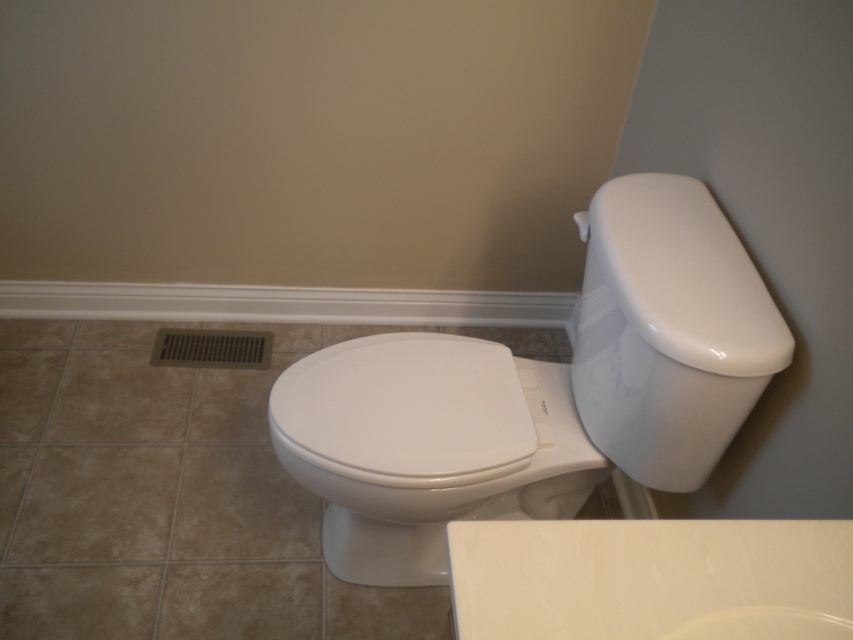
Does white glossy toilet at center have a larger size compared to white glossy toilet lid at upper right?

Correct, white glossy toilet at center is larger in size than white glossy toilet lid at upper right.

Based on the photo, which is more to the left, white glossy toilet at center or white glossy toilet lid at upper right?

white glossy toilet at center

At what (x,y) coordinates should I click in order to perform the action: click on white glossy toilet at center. Please return your answer as a coordinate pair (x, y). Looking at the image, I should click on (538, 392).

Where is `white glossy toilet at center`? This screenshot has height=640, width=853. white glossy toilet at center is located at coordinates (538, 392).

Is white glossy toilet at center shorter than white glossy toilet bowl at center?

No, white glossy toilet at center is not shorter than white glossy toilet bowl at center.

Which is more to the right, white glossy toilet at center or white glossy toilet bowl at center?

white glossy toilet at center

Does point (488, 508) come in front of point (329, 419)?

No, (488, 508) is further to viewer.

You are a GUI agent. You are given a task and a screenshot of the screen. Output one action in this format:
    pyautogui.click(x=<x>, y=<y>)
    Task: Click on the white glossy toilet at center
    The image size is (853, 640).
    Given the screenshot: What is the action you would take?
    pyautogui.click(x=538, y=392)

Does white glossy toilet bowl at center have a greater height compared to white glossy toilet lid at upper right?

Indeed, white glossy toilet bowl at center has a greater height compared to white glossy toilet lid at upper right.

Which is in front, point (521, 513) or point (584, 285)?

Point (584, 285) is more forward.

What do you see at coordinates (426, 445) in the screenshot? I see `white glossy toilet bowl at center` at bounding box center [426, 445].

Image resolution: width=853 pixels, height=640 pixels. In order to click on white glossy toilet bowl at center in this screenshot , I will do `click(426, 445)`.